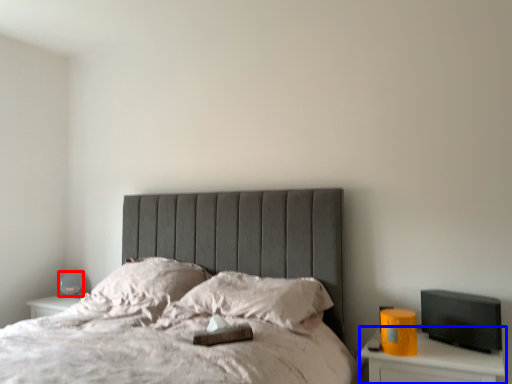
Question: Which of the following is the farthest to the observer, table lamp (highlighted by a red box) or nightstand (highlighted by a blue box)?

Choices:
 (A) table lamp
 (B) nightstand

Answer: (A)